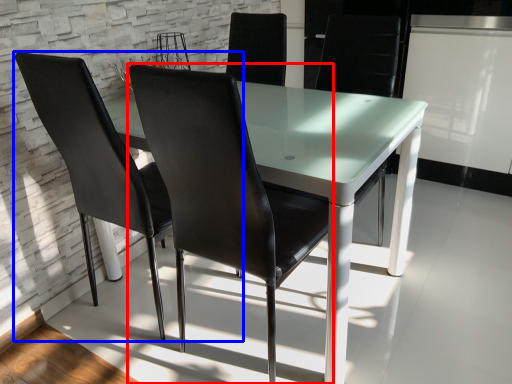
Question: Among these objects, which one is farthest to the camera, chair (highlighted by a red box) or chair (highlighted by a blue box)?

Choices:
 (A) chair
 (B) chair

Answer: (B)